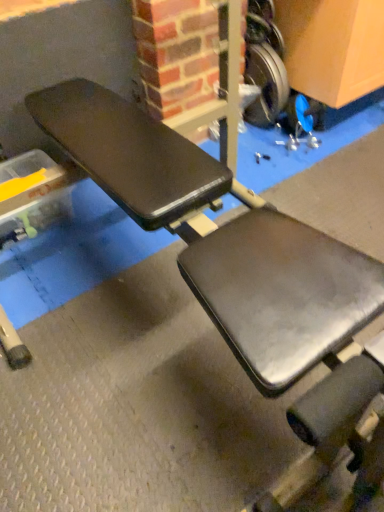
Question: Is metallic silver wheel at upper right, the first wheel from the top, at the back of silver metallic weight at upper right, which is counted as the second wheel, starting from the top?

Choices:
 (A) yes
 (B) no

Answer: (B)

Question: Is silver metallic weight at upper right, which is counted as the second wheel, starting from the top, shorter than metallic silver wheel at upper right, the first wheel from the top?

Choices:
 (A) yes
 (B) no

Answer: (B)

Question: Can you confirm if silver metallic weight at upper right, which is counted as the second wheel, starting from the top, is positioned to the left of metallic silver wheel at upper right, the first wheel from the top?

Choices:
 (A) yes
 (B) no

Answer: (B)

Question: Is silver metallic weight at upper right, which is counted as the second wheel, starting from the top, closer to the viewer compared to metallic silver wheel at upper right, the first wheel from the top?

Choices:
 (A) no
 (B) yes

Answer: (A)

Question: Can metallic silver wheel at upper right, the first wheel from the top, be found inside silver metallic weight at upper right, the 1th wheel from the bottom?

Choices:
 (A) yes
 (B) no

Answer: (B)

Question: From the image's perspective, is silver metallic weight at upper right, the 1th wheel from the bottom, located beneath metallic silver wheel at upper right, the first wheel from the top?

Choices:
 (A) no
 (B) yes

Answer: (B)

Question: Is metallic silver wheel at upper right, the 2th wheel ordered from the bottom, further to the viewer compared to silver metallic weight at upper right, the 1th wheel from the bottom?

Choices:
 (A) no
 (B) yes

Answer: (A)

Question: From the image's perspective, is metallic silver wheel at upper right, the first wheel from the top, located beneath silver metallic weight at upper right, the 1th wheel from the bottom?

Choices:
 (A) no
 (B) yes

Answer: (A)

Question: Is metallic silver wheel at upper right, the 2th wheel ordered from the bottom, at the left side of silver metallic weight at upper right, which is counted as the second wheel, starting from the top?

Choices:
 (A) yes
 (B) no

Answer: (A)

Question: Considering the relative sizes of metallic silver wheel at upper right, the first wheel from the top, and silver metallic weight at upper right, which is counted as the second wheel, starting from the top, in the image provided, is metallic silver wheel at upper right, the first wheel from the top, smaller than silver metallic weight at upper right, which is counted as the second wheel, starting from the top,?

Choices:
 (A) yes
 (B) no

Answer: (A)

Question: From the image's perspective, is metallic silver wheel at upper right, the 2th wheel ordered from the bottom, above silver metallic weight at upper right, which is counted as the second wheel, starting from the top?

Choices:
 (A) yes
 (B) no

Answer: (A)

Question: Could silver metallic weight at upper right, which is counted as the second wheel, starting from the top, be considered to be inside metallic silver wheel at upper right, the first wheel from the top?

Choices:
 (A) yes
 (B) no

Answer: (B)

Question: From a real-world perspective, relative to metallic silver wheel at upper right, the first wheel from the top, is silver metallic weight at upper right, which is counted as the second wheel, starting from the top, vertically above or below?

Choices:
 (A) below
 (B) above

Answer: (A)